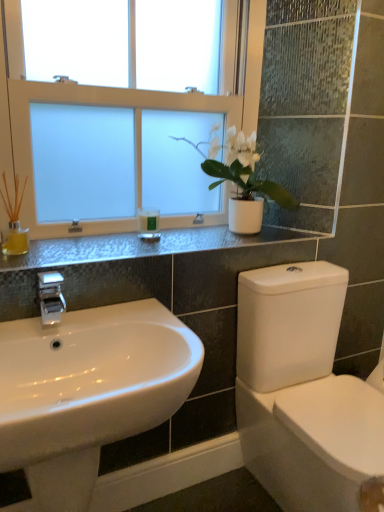
Identify the location of vacant space to the right of silver metallic faucet at left. click(x=124, y=317).